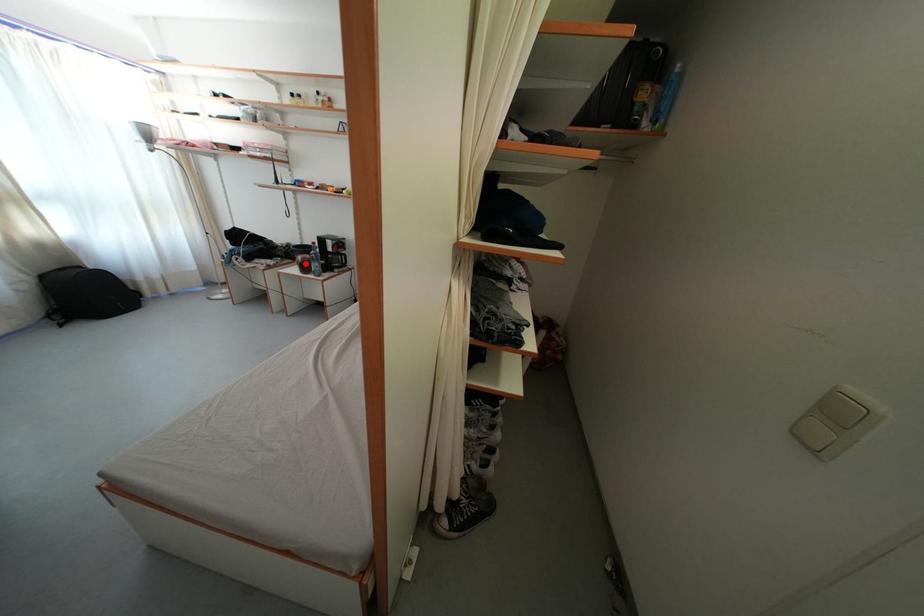
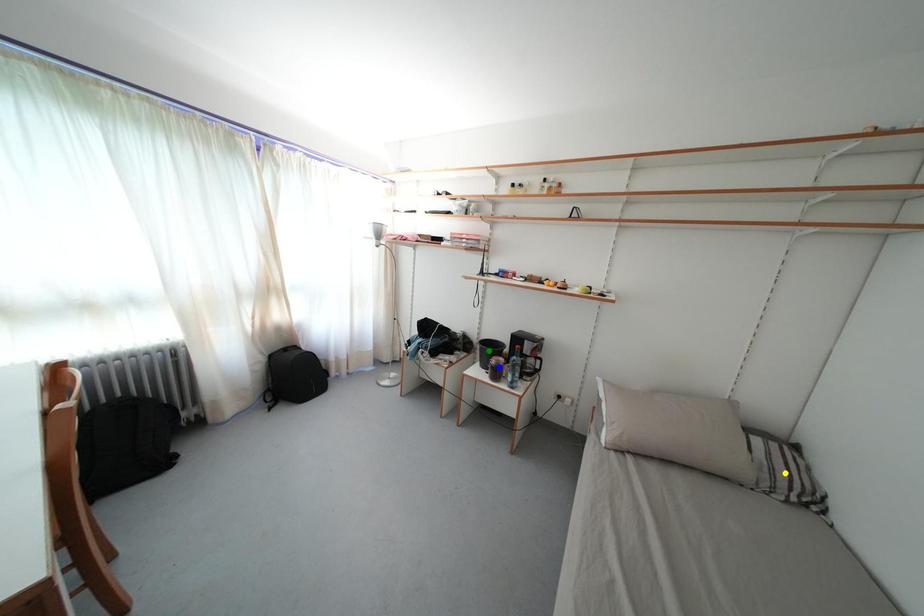
Question: I am providing you with two images of the same scene from different viewpoints. A red point is marked on the first image. You are given multiple points on the second image. Which point in image 2 represents the same 3d spot as the red point in image 1?

Choices:
 (A) green point
 (B) yellow point
 (C) blue point

Answer: (C)